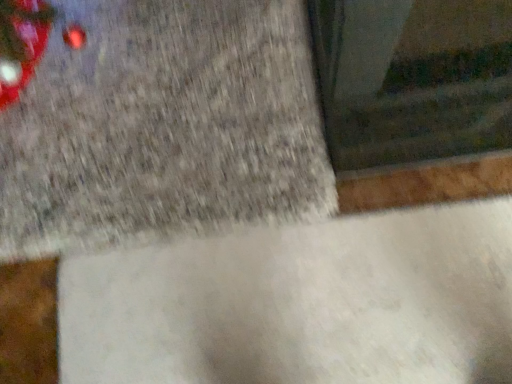
Question: Visually, is gray concrete at upper left, the second concrete ordered from the bottom, positioned to the left or to the right of white matte concrete at center, which is the first concrete from bottom to top?

Choices:
 (A) right
 (B) left

Answer: (B)

Question: Considering the positions of point (176, 165) and point (243, 347), is point (176, 165) closer or farther from the camera than point (243, 347)?

Choices:
 (A) closer
 (B) farther

Answer: (B)

Question: Relative to white matte concrete at center, which is the first concrete from bottom to top, is gray concrete at upper left, the second concrete ordered from the bottom, in front or behind?

Choices:
 (A) front
 (B) behind

Answer: (B)

Question: Considering the positions of white matte concrete at center, which is the first concrete from bottom to top, and gray concrete at upper left, the first concrete positioned from the top, in the image, is white matte concrete at center, which is the first concrete from bottom to top, bigger or smaller than gray concrete at upper left, the first concrete positioned from the top,?

Choices:
 (A) big
 (B) small

Answer: (B)

Question: From the image's perspective, is white matte concrete at center, which is the 2th concrete in top-to-bottom order, positioned above or below gray concrete at upper left, the second concrete ordered from the bottom?

Choices:
 (A) above
 (B) below

Answer: (B)

Question: From a real-world perspective, is white matte concrete at center, which is the 2th concrete in top-to-bottom order, above or below gray concrete at upper left, the first concrete positioned from the top?

Choices:
 (A) above
 (B) below

Answer: (B)

Question: Considering the positions of point (382, 311) and point (93, 57), is point (382, 311) closer or farther from the camera than point (93, 57)?

Choices:
 (A) farther
 (B) closer

Answer: (B)